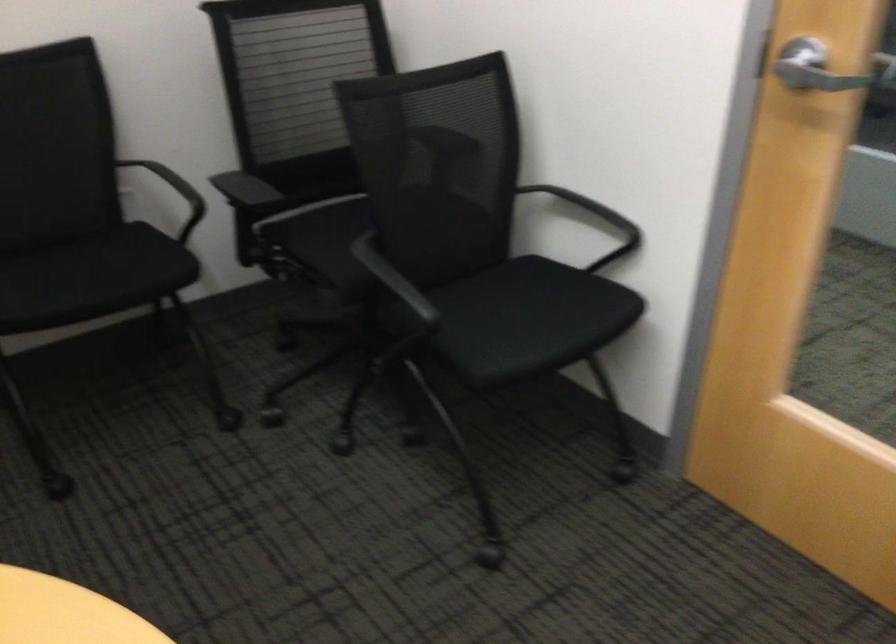
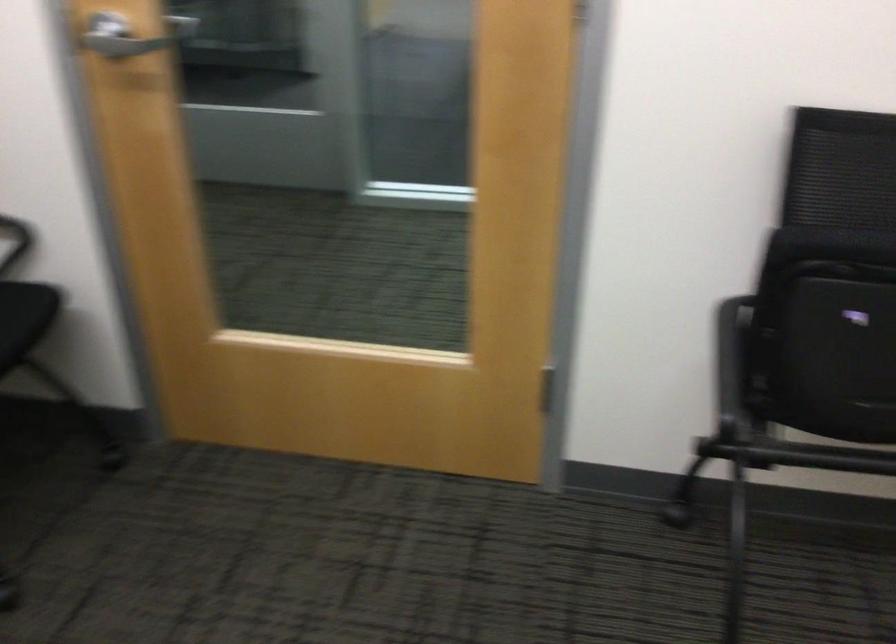
Question: The camera is either moving clockwise (left) or counter-clockwise (right) around the object. The first image is from the beginning of the video and the second image is from the end. Is the camera moving left or right when shooting the video?

Choices:
 (A) Left
 (B) Right

Answer: (A)